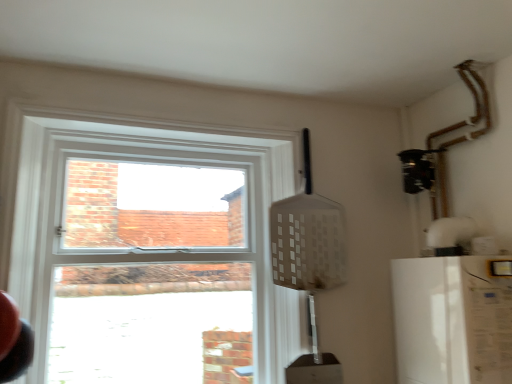
The width and height of the screenshot is (512, 384). Identify the location of clear glass window at upper left. (151, 251).

What is the approximate width of clear glass window at upper left?

4.06 inches.

The width and height of the screenshot is (512, 384). What do you see at coordinates (151, 251) in the screenshot?
I see `clear glass window at upper left` at bounding box center [151, 251].

Identify the location of white matte refrigerator at right. (451, 321).

The height and width of the screenshot is (384, 512). What do you see at coordinates (451, 321) in the screenshot? I see `white matte refrigerator at right` at bounding box center [451, 321].

Measure the distance between white matte refrigerator at right and camera.

The distance of white matte refrigerator at right from camera is 4.49 feet.

Find the location of a particular element. This screenshot has height=384, width=512. clear glass window at upper left is located at coordinates (151, 251).

Is clear glass window at upper left to the left or to the right of white matte refrigerator at right in the image?

clear glass window at upper left is to the left of white matte refrigerator at right.

Which is in front, clear glass window at upper left or white matte refrigerator at right?

white matte refrigerator at right is closer to the camera.

Considering the points (112, 282) and (503, 285), which point is in front, point (112, 282) or point (503, 285)?

The point (503, 285) is closer to the camera.

From the image's perspective, is clear glass window at upper left located above or below white matte refrigerator at right?

clear glass window at upper left is situated higher than white matte refrigerator at right in the image.

Consider the image. From a real-world perspective, which is physically below, clear glass window at upper left or white matte refrigerator at right?

In real-world perspective, white matte refrigerator at right is lower.

Between clear glass window at upper left and white matte refrigerator at right, which one has smaller width?

Thinner between the two is clear glass window at upper left.

Is clear glass window at upper left taller or shorter than white matte refrigerator at right?

clear glass window at upper left is taller than white matte refrigerator at right.

Is clear glass window at upper left bigger than white matte refrigerator at right?

Correct, clear glass window at upper left is larger in size than white matte refrigerator at right.

Would you say white matte refrigerator at right is part of clear glass window at upper left's contents?

That's incorrect, white matte refrigerator at right is not inside clear glass window at upper left.

Looking at this image, is clear glass window at upper left placed right next to white matte refrigerator at right?

clear glass window at upper left is not next to white matte refrigerator at right, and they're not touching.

Is clear glass window at upper left looking in the opposite direction of white matte refrigerator at right?

No, white matte refrigerator at right is not at the back of clear glass window at upper left.

The width and height of the screenshot is (512, 384). I want to click on appliance below the clear glass window at upper left (from a real-world perspective), so click(x=451, y=321).

Is white matte refrigerator at right to the left or to the right of clear glass window at upper left in the image?

Clearly, white matte refrigerator at right is on the right of clear glass window at upper left in the image.

Is white matte refrigerator at right in front of or behind clear glass window at upper left in the image?

In the image, white matte refrigerator at right appears in front of clear glass window at upper left.

Considering the positions of point (462, 365) and point (227, 365), is point (462, 365) closer or farther from the camera than point (227, 365)?

Point (462, 365) is positioned closer to the camera compared to point (227, 365).

From the image's perspective, between white matte refrigerator at right and clear glass window at upper left, which one is located above?

clear glass window at upper left appears higher in the image.

From a real-world perspective, relative to clear glass window at upper left, is white matte refrigerator at right vertically above or below?

white matte refrigerator at right is situated lower than clear glass window at upper left in the real world.

Does white matte refrigerator at right have a lesser width compared to clear glass window at upper left?

No, white matte refrigerator at right is not thinner than clear glass window at upper left.

Does white matte refrigerator at right have a lesser height compared to clear glass window at upper left?

Indeed, white matte refrigerator at right has a lesser height compared to clear glass window at upper left.

Looking at this image, looking at the image, does white matte refrigerator at right seem bigger or smaller compared to clear glass window at upper left?

Considering their sizes, white matte refrigerator at right takes up less space than clear glass window at upper left.

Is clear glass window at upper left a part of white matte refrigerator at right?

No.

Is white matte refrigerator at right next to clear glass window at upper left and touching it?

white matte refrigerator at right and clear glass window at upper left are not in contact.

Is white matte refrigerator at right oriented towards clear glass window at upper left?

No.

How different are the orientations of white matte refrigerator at right and clear glass window at upper left in degrees?

The facing directions of white matte refrigerator at right and clear glass window at upper left are 88.4 degrees apart.

Measure the distance from white matte refrigerator at right to clear glass window at upper left.

31.07 inches.

The height and width of the screenshot is (384, 512). In order to click on window above the white matte refrigerator at right (from a real-world perspective) in this screenshot , I will do `click(151, 251)`.

Find the location of `window on the left of white matte refrigerator at right`. window on the left of white matte refrigerator at right is located at coordinates (151, 251).

This screenshot has height=384, width=512. In order to click on appliance in front of the clear glass window at upper left in this screenshot , I will do `click(451, 321)`.